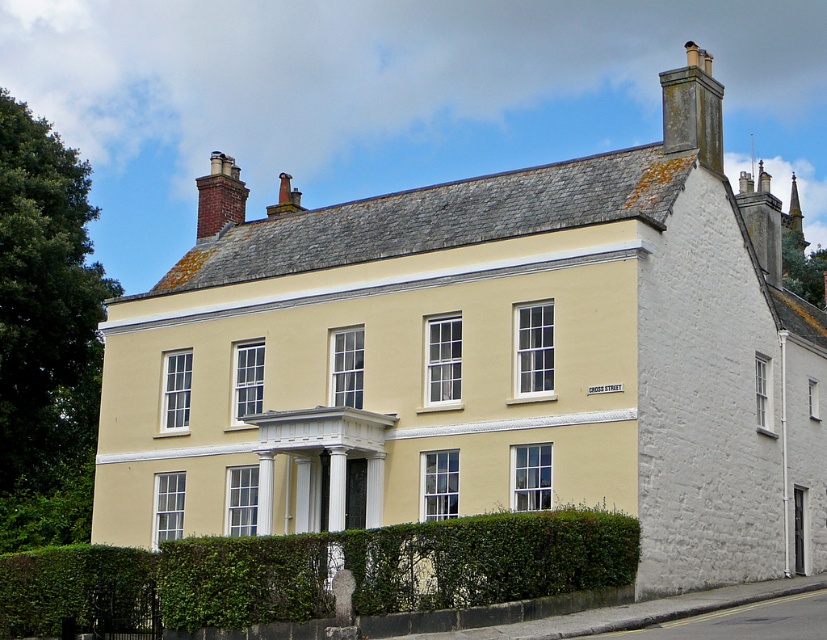
Question: Which point appears closest to the camera in this image?

Choices:
 (A) (531, 536)
 (B) (715, 97)
 (C) (213, 157)
 (D) (751, 241)

Answer: (A)

Question: Which object appears closest to the camera in this image?

Choices:
 (A) brick chimney at upper left
 (B) white stone chimney at upper right
 (C) green leafy hedge at lower center
 (D) dark gray stone chimney at upper right

Answer: (C)

Question: Can you confirm if green leafy hedge at lower center is positioned to the right of white stone chimney at upper right?

Choices:
 (A) yes
 (B) no

Answer: (B)

Question: Considering the relative positions of green leafy hedge at lower center and white stone chimney at upper right in the image provided, where is green leafy hedge at lower center located with respect to white stone chimney at upper right?

Choices:
 (A) below
 (B) above

Answer: (A)

Question: Is dark gray stone chimney at upper right further to the viewer compared to white stone chimney at upper right?

Choices:
 (A) no
 (B) yes

Answer: (A)

Question: Which point appears farthest from the camera in this image?

Choices:
 (A) (660, 81)
 (B) (218, 625)
 (C) (763, 216)
 (D) (209, 198)

Answer: (A)